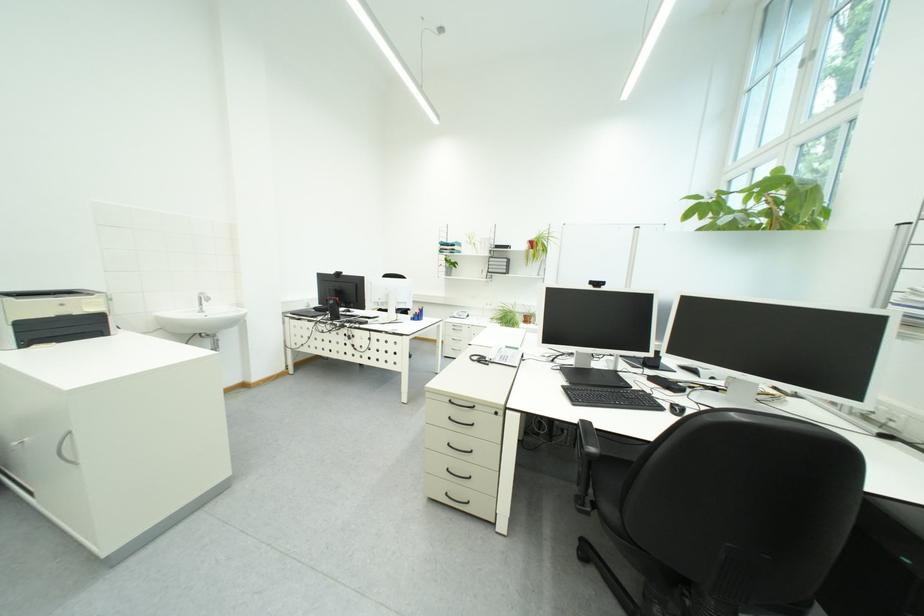
Where would you turn the faucet handle? Please return your answer as a coordinate pair (x, y).

(201, 300)